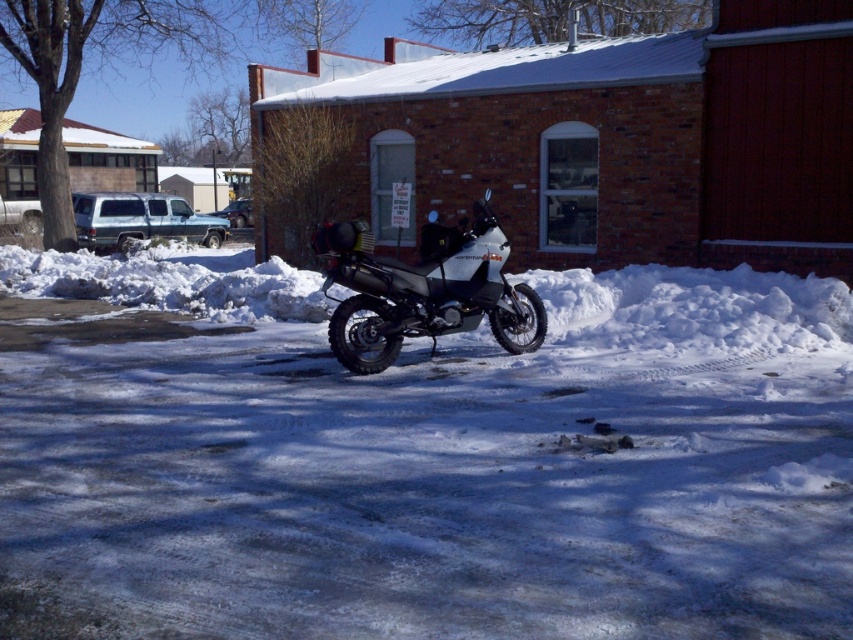
You are a delivery person needing to park your motorcycle in a spot that has enough space. You see the white powdery snow at center and the white matte adventure motorcycle at center. Which object is positioned to the left, and would that area be suitable for parking?

The white powdery snow at center is to the left of the white matte adventure motorcycle at center. Since the snow is a flat surface, it could be suitable for parking the motorcycle, but you should ensure there is enough space and that the ground is stable.

You are planning to park your white matte adventure motorcycle at center in a snowy area. The parking space has a maximum size limit of 2 meters. Can the white powdery snow at center accommodate the motorcycle?

The white powdery snow at center is larger in size than the white matte adventure motorcycle at center, so yes, the snow can accommodate the motorcycle as it has enough space.